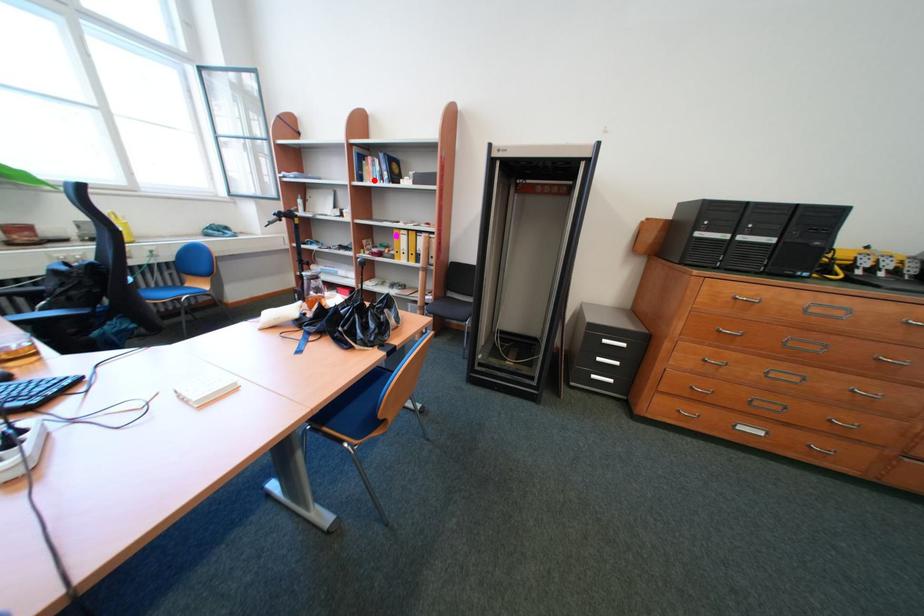
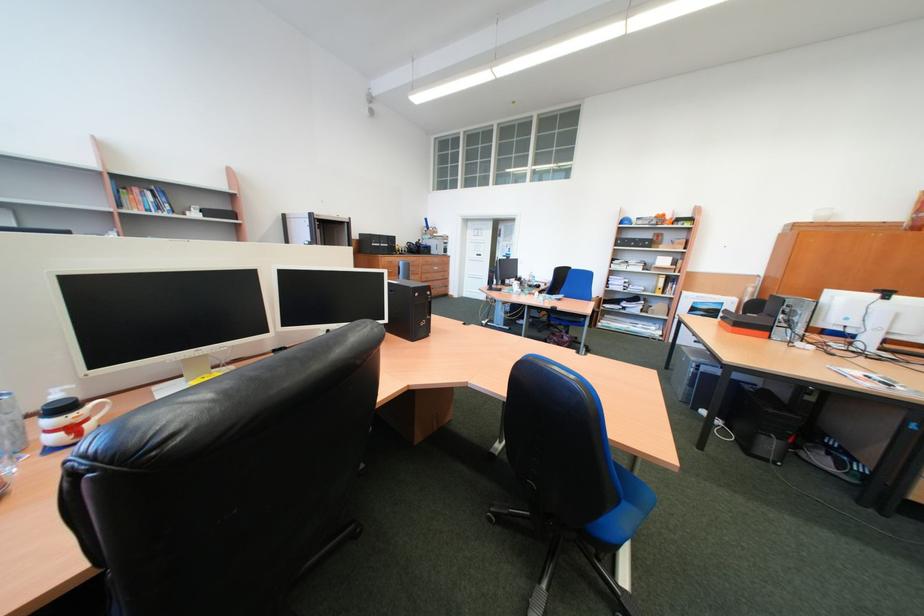
Question: I am providing you with two images of the same scene from different viewpoints. Given a red point in image1, look at the same physical point in image2. Is it:

Choices:
 (A) Closer to the viewpoint
 (B) Farther from the viewpoint

Answer: (B)